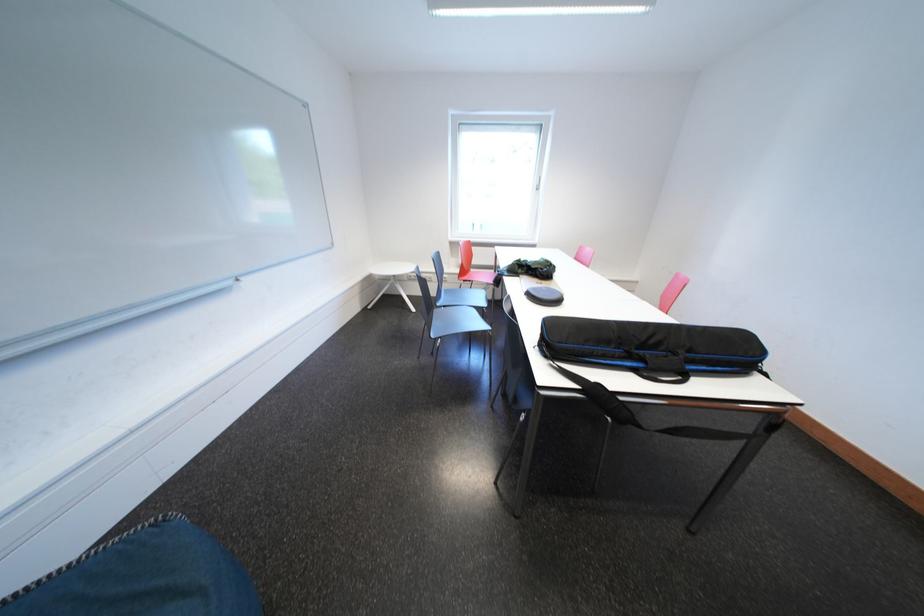
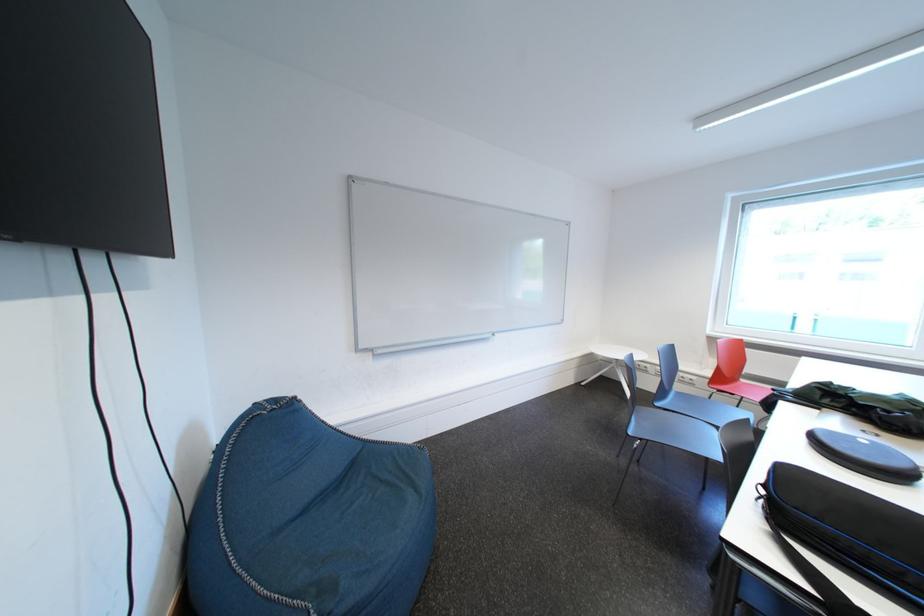
Find the pixel in the second image that matches (x=447, y=309) in the first image.

(666, 408)